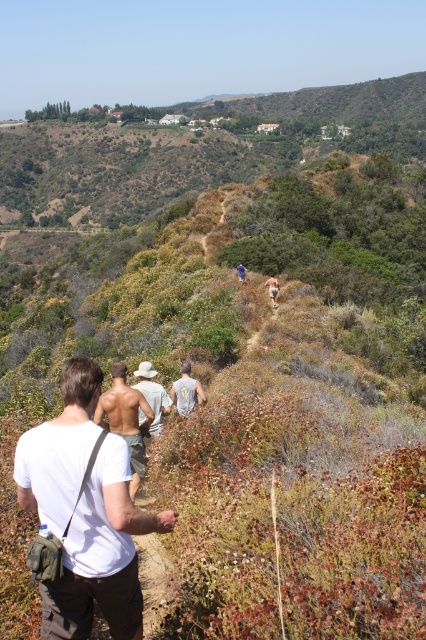
Based on the photo, you are a hiker looking at the group ahead. You notice two hikers wearing shirts at the center of the image. Which hiker, the one in the white cotton shirt at center or the light gray shirt at center, is standing closer to you?

The white cotton shirt at center is taller than the light gray shirt at center, so the white cotton shirt at center is closer to you because objects that appear taller in the image are generally closer to the viewer.

You are a photographer trying to capture a shot of the tan woven hat at center and the tan skin man at center. Since you want to highlight the hat, which object should you focus on first given their sizes?

The tan woven hat at center is thinner than the tan skin man at center, so focusing on the tan woven hat at center first would allow you to highlight its smaller size effectively.